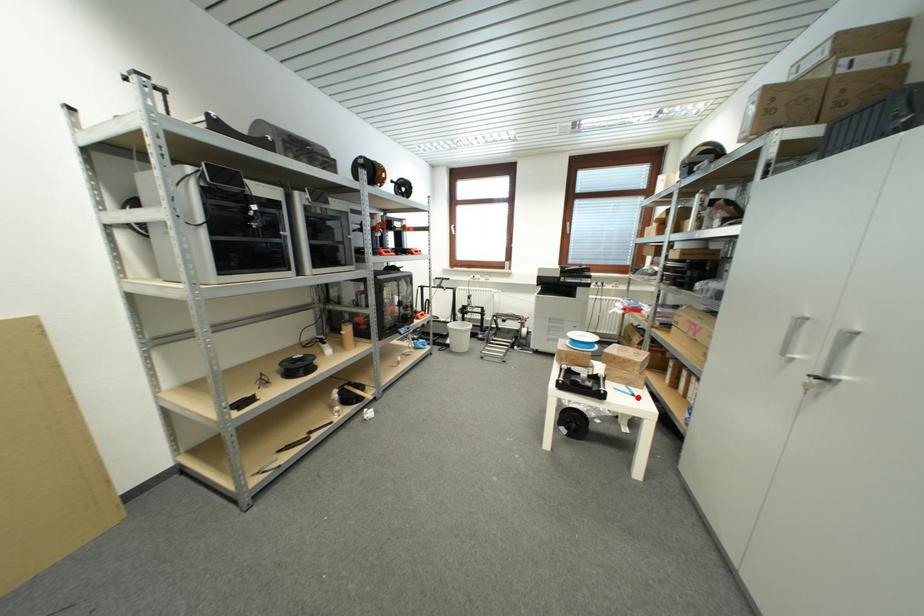
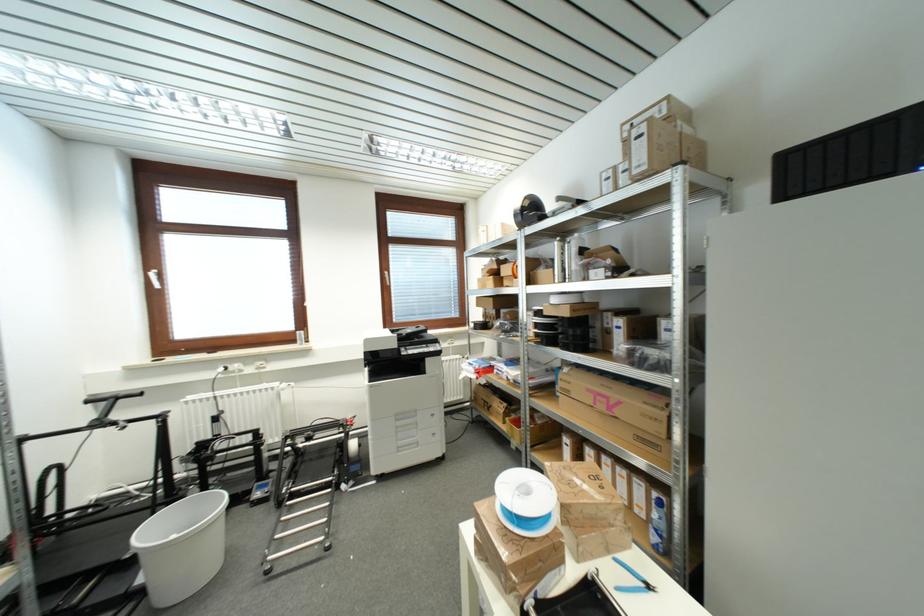
Locate, in the second image, the point that corresponds to the highlighted location in the first image.

(652, 590)